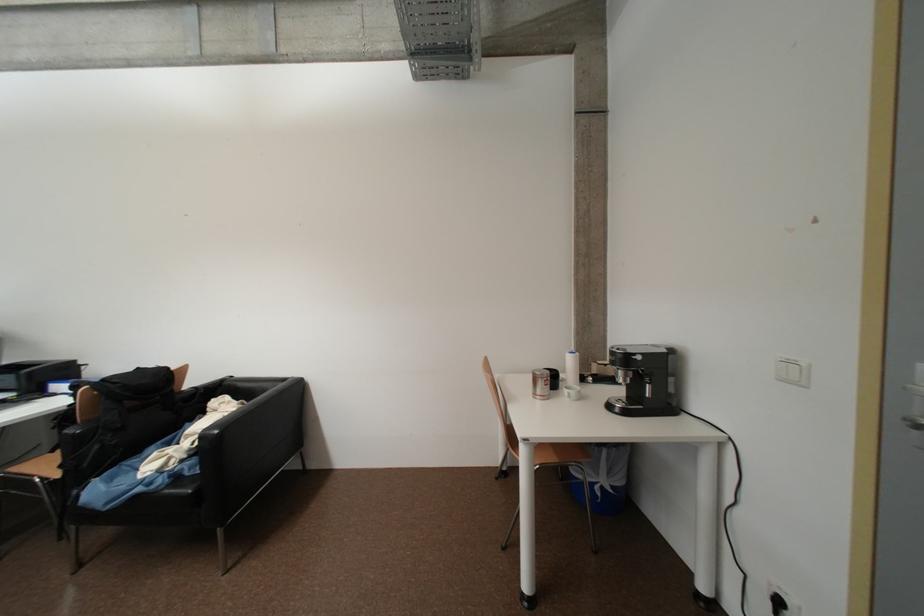
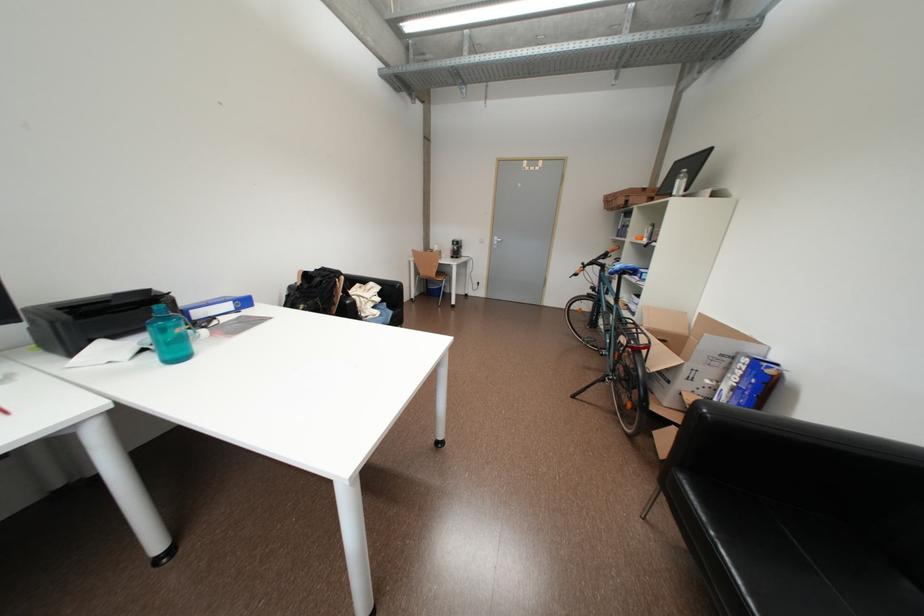
Question: I am providing you with two images of the same scene from different viewpoints. After the viewpoint changes to image2, which objects are now occluded?

Choices:
 (A) black backpack
 (B) blue bicycle saddle
 (C) yellow shaker bottle
 (D) sofa sitting surface

Answer: (A)